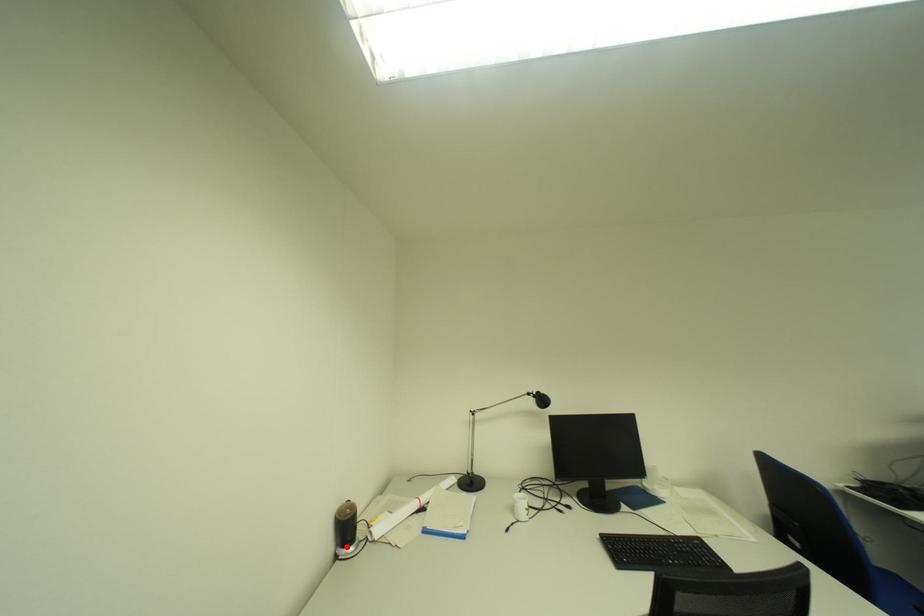
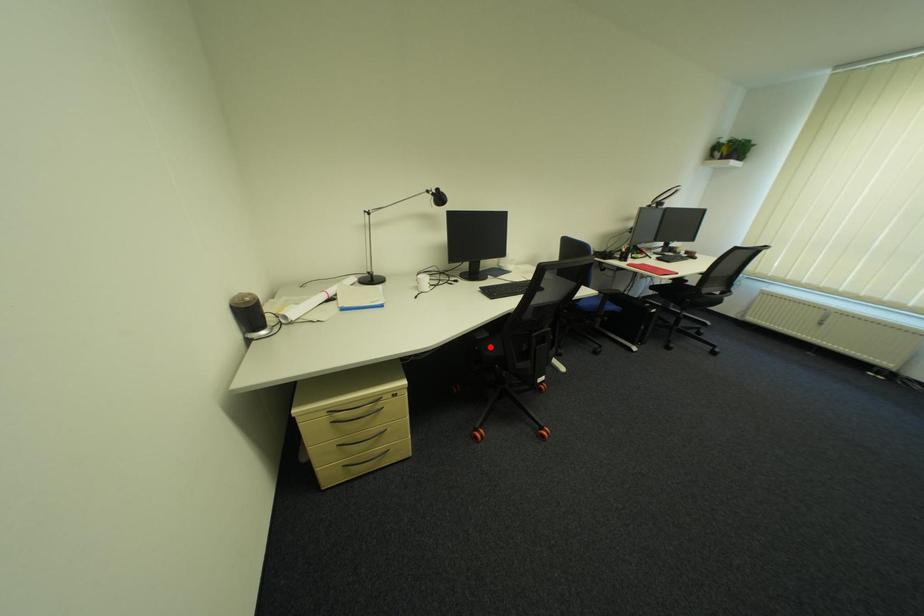
I am providing you with two images of the same scene from different viewpoints. A red point is marked on the first image and another point is marked on the second image. Is the marked point in image1 the same physical position as the marked point in image2?

No